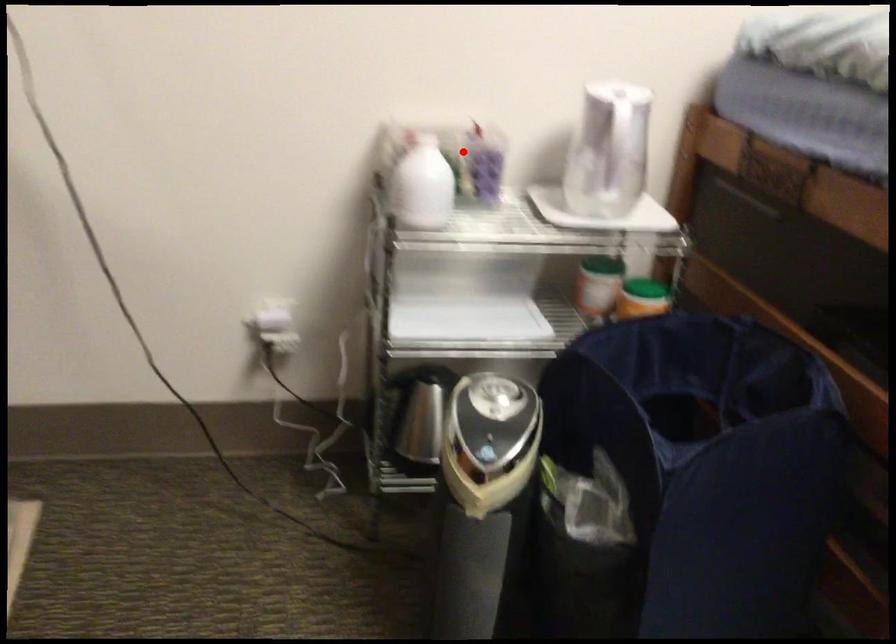
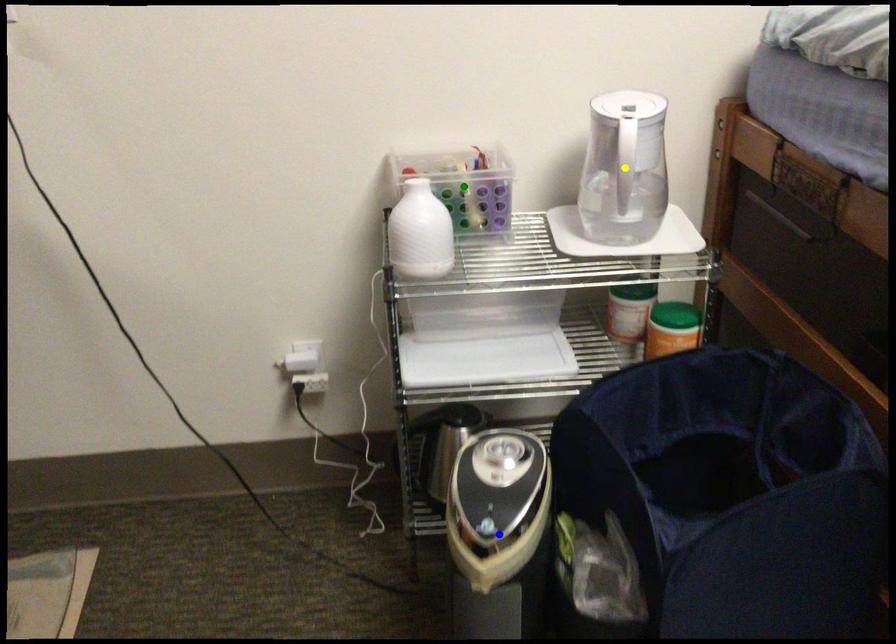
Question: I am providing you with two images of the same scene from different viewpoints. A red point is marked on the first image. You are given multiple points on the second image. In image 2, which mark is for the same physical point as the one in image 1?

Choices:
 (A) yellow point
 (B) blue point
 (C) green point

Answer: (C)